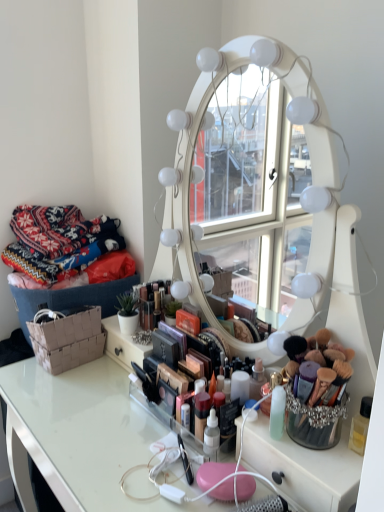
Question: Does knitted fabric at left have a lesser width compared to clear acrylic table at center?

Choices:
 (A) yes
 (B) no

Answer: (A)

Question: Is knitted fabric at left next to clear acrylic table at center?

Choices:
 (A) no
 (B) yes

Answer: (A)

Question: Is knitted fabric at left smaller than clear acrylic table at center?

Choices:
 (A) yes
 (B) no

Answer: (A)

Question: Is knitted fabric at left not near clear acrylic table at center?

Choices:
 (A) no
 (B) yes

Answer: (A)

Question: Would you say knitted fabric at left contains clear acrylic table at center?

Choices:
 (A) no
 (B) yes

Answer: (A)

Question: Is knitted fabric at left to the left of clear acrylic table at center from the viewer's perspective?

Choices:
 (A) no
 (B) yes

Answer: (B)

Question: Is the depth of brown woven basket at lower left less than that of knitted fabric at left?

Choices:
 (A) no
 (B) yes

Answer: (B)

Question: From the image's perspective, is brown woven basket at lower left under knitted fabric at left?

Choices:
 (A) yes
 (B) no

Answer: (A)

Question: Would you say brown woven basket at lower left is a long distance from knitted fabric at left?

Choices:
 (A) no
 (B) yes

Answer: (A)

Question: Is brown woven basket at lower left to the left of knitted fabric at left from the viewer's perspective?

Choices:
 (A) yes
 (B) no

Answer: (B)

Question: Is brown woven basket at lower left facing away from knitted fabric at left?

Choices:
 (A) yes
 (B) no

Answer: (B)

Question: Considering the relative sizes of brown woven basket at lower left and knitted fabric at left in the image provided, is brown woven basket at lower left taller than knitted fabric at left?

Choices:
 (A) no
 (B) yes

Answer: (A)

Question: Can you confirm if brown woven basket at lower left is shorter than clear acrylic table at center?

Choices:
 (A) no
 (B) yes

Answer: (B)